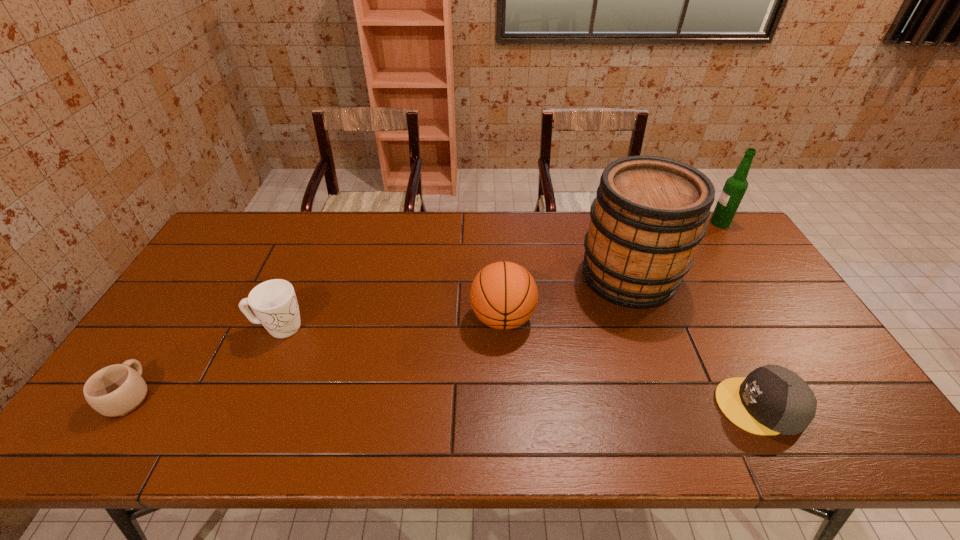
The width and height of the screenshot is (960, 540). I want to click on free location located 0.210m on the side of the nearer mug with the handle, so click(x=185, y=311).

You are a GUI agent. You are given a task and a screenshot of the screen. Output one action in this format:
    pyautogui.click(x=<x>, y=<y>)
    Task: Click on the free spot located on the side of the nearer mug with the handle
    
    Given the screenshot: What is the action you would take?
    pyautogui.click(x=181, y=316)

Find the location of a particular element. cider that is at the far edge is located at coordinates (649, 215).

Locate an element on the screen. beer bottle that is at the far edge is located at coordinates (735, 186).

Where is `cap that is positioned at the near edge`? cap that is positioned at the near edge is located at coordinates 771,400.

Where is `mug that is at the near edge`? Image resolution: width=960 pixels, height=540 pixels. mug that is at the near edge is located at coordinates (118, 390).

Image resolution: width=960 pixels, height=540 pixels. What are the coordinates of `object present at the left edge` in the screenshot? It's located at (118, 390).

You are a GUI agent. You are given a task and a screenshot of the screen. Output one action in this format:
    pyautogui.click(x=<x>, y=<y>)
    Task: Click on the beer bottle that is at the right edge
    The height and width of the screenshot is (540, 960).
    Given the screenshot: What is the action you would take?
    pyautogui.click(x=735, y=186)

Locate an element on the screen. This screenshot has height=540, width=960. cap at the right edge is located at coordinates (771, 400).

Locate an element on the screen. object positioned at the near left corner is located at coordinates (118, 390).